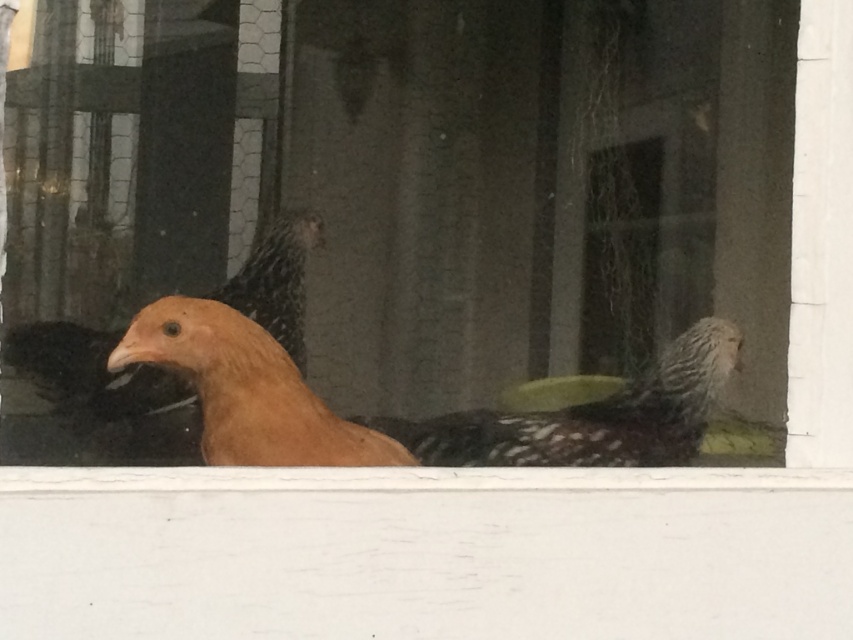
Is matte orange chicken at center to the right of golden feathered chicken at center from the viewer's perspective?

Correct, you'll find matte orange chicken at center to the right of golden feathered chicken at center.

Does point (352, 74) come closer to viewer compared to point (306, 401)?

No.

Is point (386, 204) positioned behind point (158, 353)?

Yes.

The height and width of the screenshot is (640, 853). I want to click on matte orange chicken at center, so click(401, 209).

Looking at this image, who is shorter, golden feathered chicken at center or matte orange bird at center?

With less height is golden feathered chicken at center.

Does point (180, 342) come closer to viewer compared to point (120, 420)?

Yes, it is in front of point (120, 420).

Who is more forward, (190, 346) or (57, 378)?

Positioned in front is point (190, 346).

What are the coordinates of `golden feathered chicken at center` in the screenshot? It's located at (247, 390).

Is matte orange chicken at center behind matte orange bird at center?

No, matte orange chicken at center is in front of matte orange bird at center.

Is matte orange chicken at center positioned in front of matte orange bird at center?

Yes.

Between point (761, 221) and point (178, 445), which one is positioned in front?

Point (178, 445) is more forward.

The height and width of the screenshot is (640, 853). What are the coordinates of `matte orange chicken at center` in the screenshot? It's located at (401, 209).